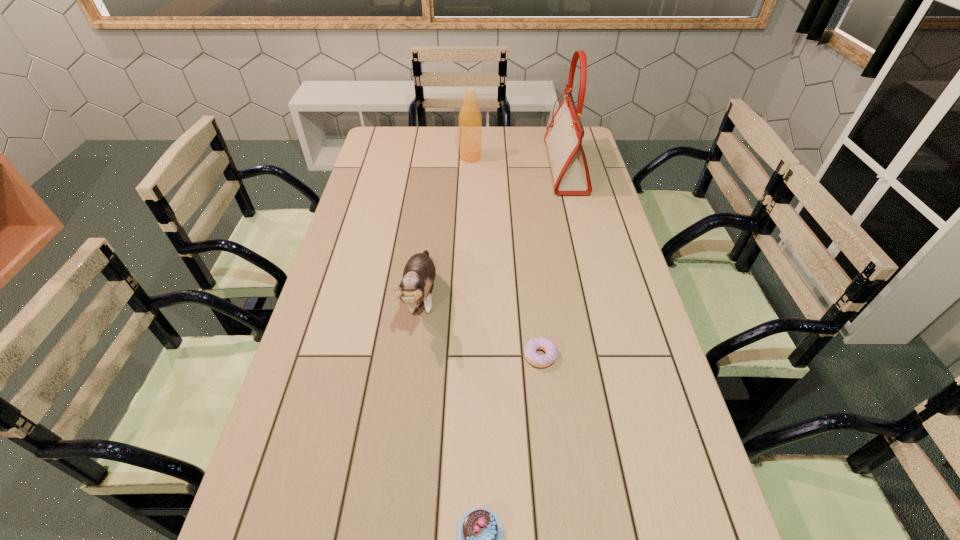
In order to click on free point between the cat and the doughnut in this screenshot , I will do `click(481, 326)`.

Identify the location of object that is the second closest to the handbag. The image size is (960, 540). (419, 273).

I want to click on object that is the second nearest to the leftmost object, so pos(480,533).

Locate an element on the screen. This screenshot has height=540, width=960. free spot that satisfies the following two spatial constraints: 1. on the back side of the doughnut; 2. on the left side of the rightmost object is located at coordinates (519, 168).

At what (x,y) coordinates should I click in order to perform the action: click on free spot that satisfies the following two spatial constraints: 1. at the face of the shortest object; 2. on the left side of the cat. Please return your answer as a coordinate pair (x, y). Image resolution: width=960 pixels, height=540 pixels. Looking at the image, I should click on (415, 356).